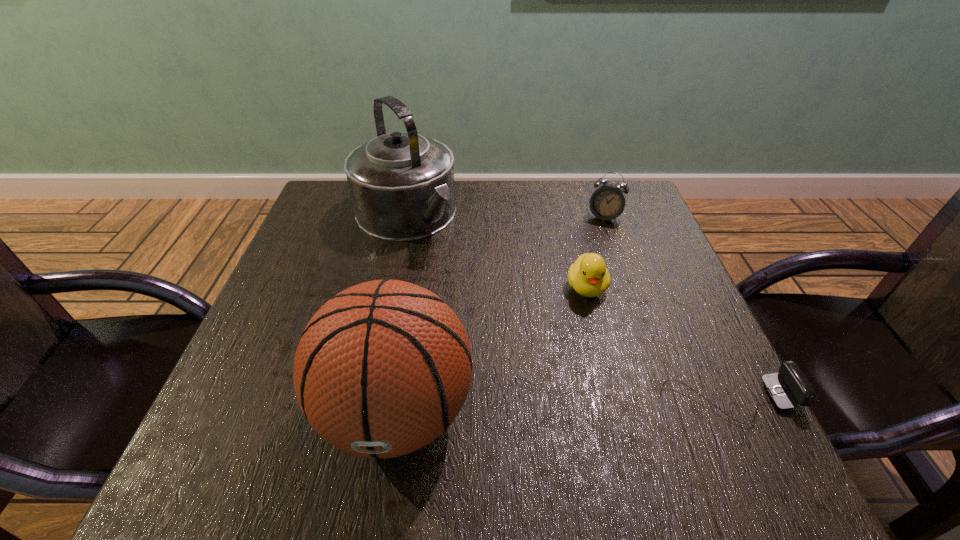
Identify the location of vacant space located on the face of the alarm clock. (565, 337).

Image resolution: width=960 pixels, height=540 pixels. Identify the location of vacant area located 0.050m on the face of the alarm clock. (597, 238).

Find the location of a particular element. The height and width of the screenshot is (540, 960). vacant space located 0.190m on the beak of the duckling is located at coordinates (598, 384).

Find the location of a particular element. This screenshot has height=540, width=960. free space located 0.230m on the beak of the duckling is located at coordinates (600, 403).

At what (x,y) coordinates should I click in order to perform the action: click on vacant area situated 0.060m on the beak of the duckling. Please return your answer as a coordinate pair (x, y). Looking at the image, I should click on (591, 328).

Identify the location of kettle that is positioned at the far edge. (402, 188).

This screenshot has width=960, height=540. I want to click on alarm clock located in the far edge section of the desktop, so click(x=608, y=201).

Where is `basketball that is positioned at the near edge`? This screenshot has width=960, height=540. basketball that is positioned at the near edge is located at coordinates (382, 369).

Where is `webcam located in the near edge section of the desktop`? webcam located in the near edge section of the desktop is located at coordinates (791, 387).

Image resolution: width=960 pixels, height=540 pixels. What are the coordinates of `object that is positioned at the left edge` in the screenshot? It's located at (402, 188).